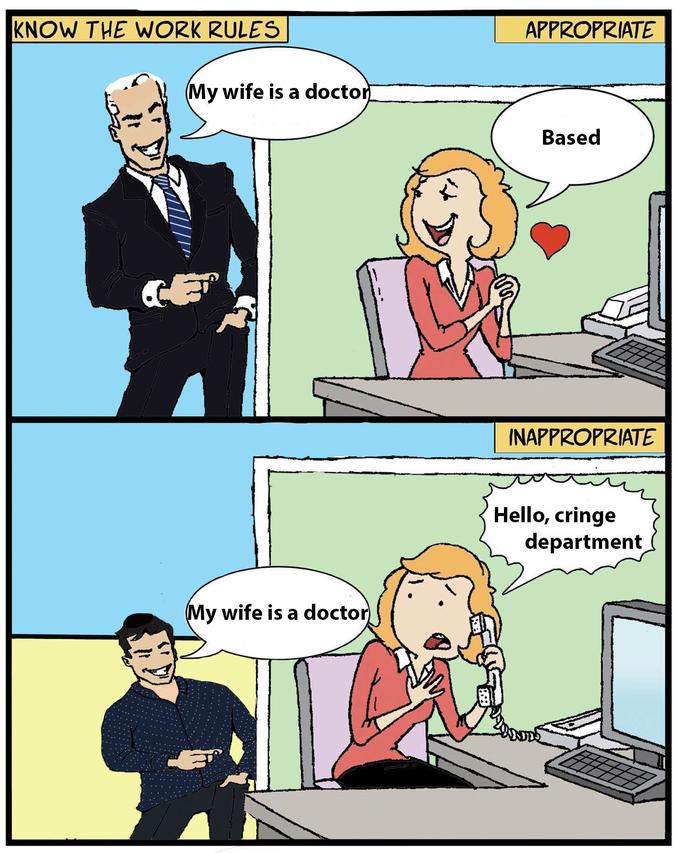
Find the location of a particular element. This screenshot has height=853, width=680. heart picture is located at coordinates (556, 240).